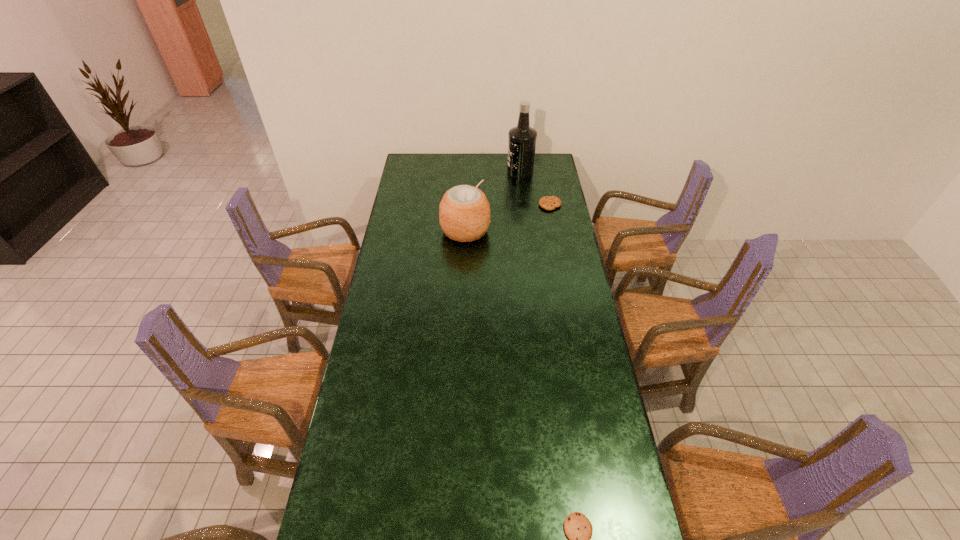
Locate an element on the screen. Image resolution: width=960 pixels, height=540 pixels. vacant space situated 0.300m on the front of the taller cookie is located at coordinates (559, 251).

Where is `object at the far edge`? object at the far edge is located at coordinates (522, 139).

Where is `liquor that is positioned at the right edge`? The image size is (960, 540). liquor that is positioned at the right edge is located at coordinates (522, 139).

What are the coordinates of `cookie that is at the right edge` in the screenshot? It's located at 547,202.

I want to click on object that is at the far right corner, so click(x=522, y=139).

Find the location of a particular element. vacant space at the far edge of the desktop is located at coordinates coord(469,161).

At what (x,y) coordinates should I click in order to perform the action: click on free space at the left edge of the desktop. Please return your answer as a coordinate pair (x, y). This screenshot has width=960, height=540. Looking at the image, I should click on (403, 190).

At what (x,y) coordinates should I click in order to perform the action: click on vacant region at the right edge. Please return your answer as a coordinate pair (x, y). The height and width of the screenshot is (540, 960). Looking at the image, I should click on (617, 445).

This screenshot has height=540, width=960. I want to click on free space between the farthest object and the third shortest object, so click(492, 201).

Locate an element on the screen. vacant space in between the second farthest object and the liquor is located at coordinates (535, 188).